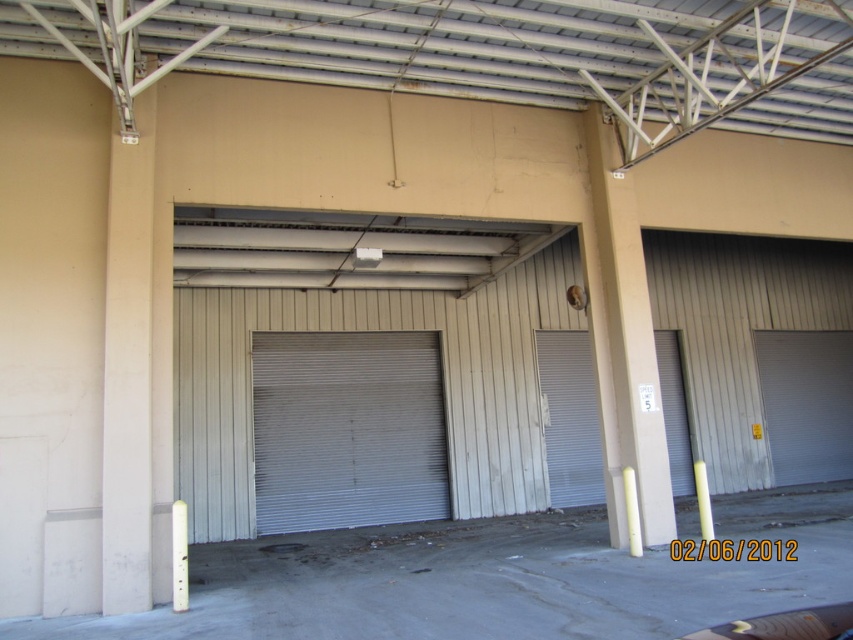
You are a delivery driver arriving at this warehouse. You need to enter through one of the doors. The white corrugated metal garage door at center and the white metallic door at right are both options. Which door is larger and more suitable for your delivery truck?

The white corrugated metal garage door at center is bigger than the white metallic door at right, so it is more suitable for your delivery truck.

You are a delivery driver arriving at this warehouse. You need to enter through one of the doors. The truck requires a door that is at least 3 meters tall. The gray metallic door at center and white metallic door at right are both closed. Which door should you choose?

The gray metallic door at center is taller than the white metallic door at right, so you should choose the gray metallic door at center since it meets the minimum height requirement of 3 meters.